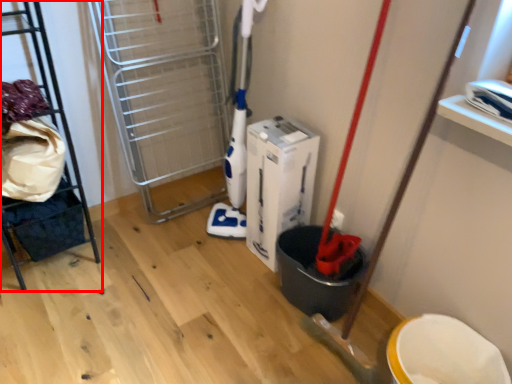
Question: Observing the image, what is the correct spatial positioning of furniture (annotated by the red box) in reference to wide?

Choices:
 (A) right
 (B) left

Answer: (B)